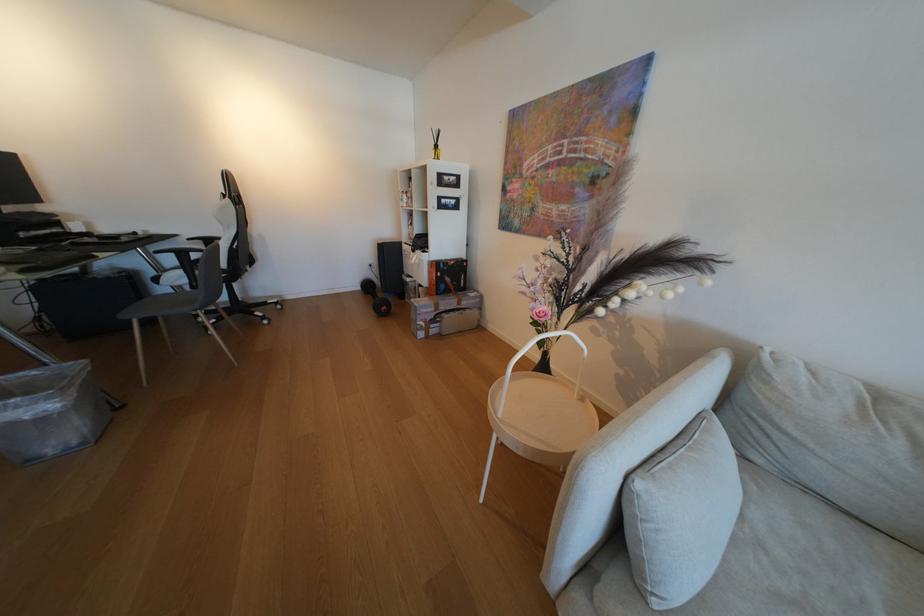
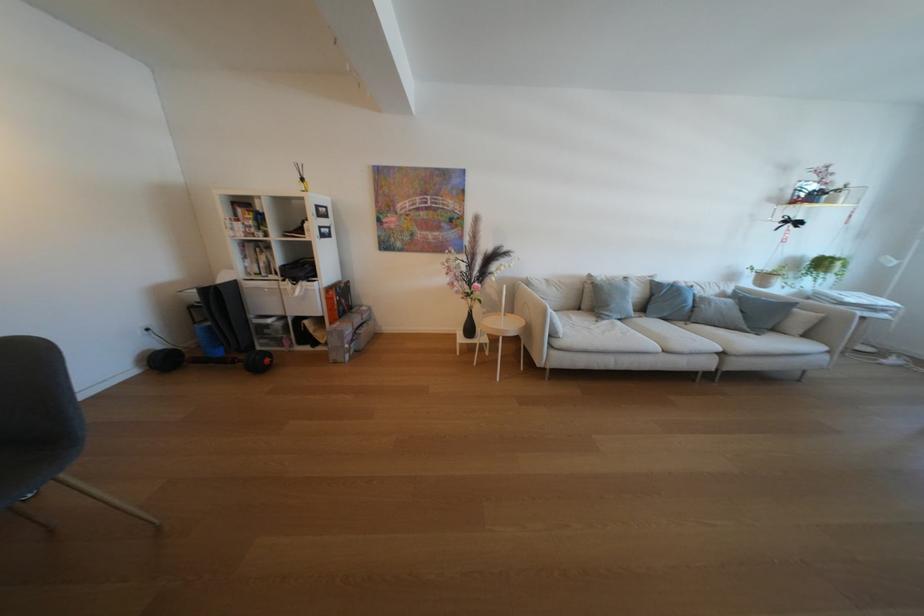
In the second image, find the point that corresponds to (x=548, y=260) in the first image.

(455, 265)